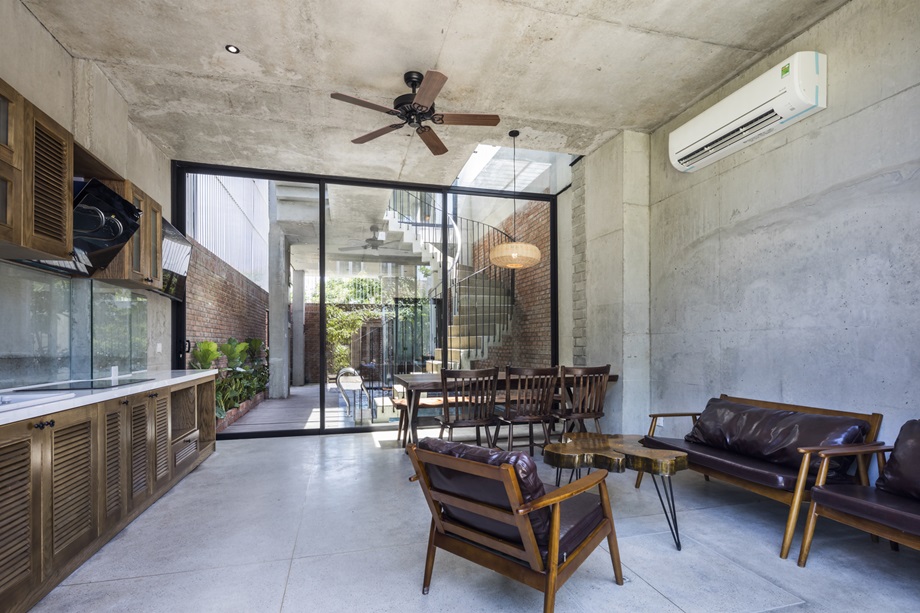
You are a GUI agent. You are given a task and a screenshot of the screen. Output one action in this format:
    pyautogui.click(x=<x>, y=<y>)
    Task: Click on the air conditioner
    The width and height of the screenshot is (920, 613).
    Given the screenshot: What is the action you would take?
    pyautogui.click(x=773, y=88), pyautogui.click(x=709, y=126)